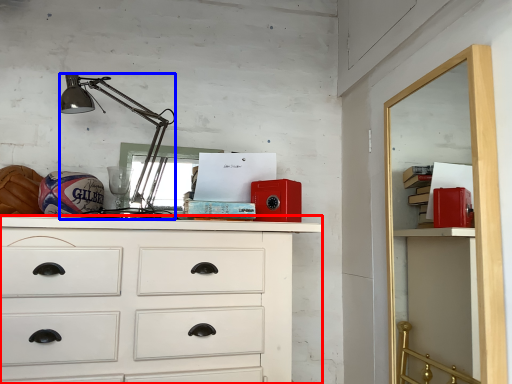
Question: Among these objects, which one is farthest to the camera, chest of drawers (highlighted by a red box) or lamp (highlighted by a blue box)?

Choices:
 (A) chest of drawers
 (B) lamp

Answer: (B)